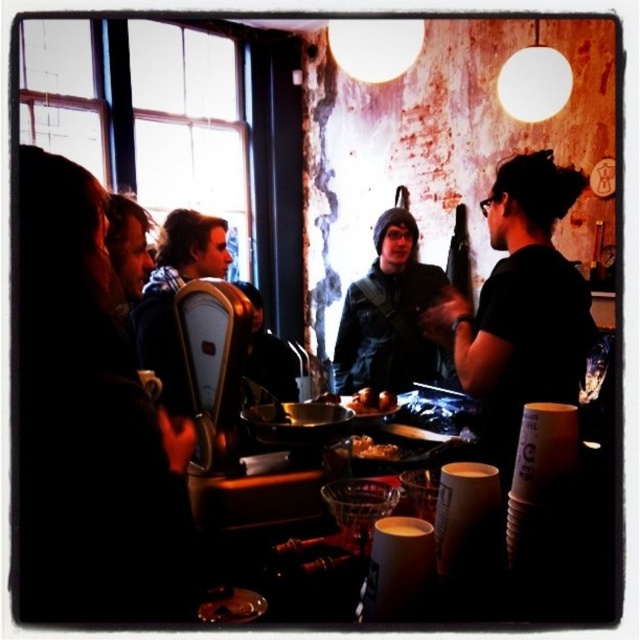
You are a guest at this gathering and want to pick up the shiny golden nuggets at center without touching the black matte shirt at center. Is this possible given their positions?

The black matte shirt at center is closer to the viewer than the shiny golden nuggets at center, so you can reach the shiny golden nuggets at center without touching the black matte shirt at center by moving around it.

You are a food delivery person who needs to place an order receipt on the table without covering any food items. Where should you put it so that it doesn t cover the golden crispy fries at center or the shiny golden nuggets at center?

Since the golden crispy fries at center is much taller than the shiny golden nuggets at center, you should place the receipt on the table in an area that is not occupied by either of these items, ensuring it doesn t cover their positions.

You are a waiter in a small cafe. You see a black matte shirt at center and shiny golden nuggets at center on the table. You need to place a new plate between them. Is there enough space to fit the plate?

The black matte shirt at center and shiny golden nuggets at center are 17.27 inches apart from each other. Since the plate is likely smaller than 17.27 inches in diameter, there should be enough space to place it between them.